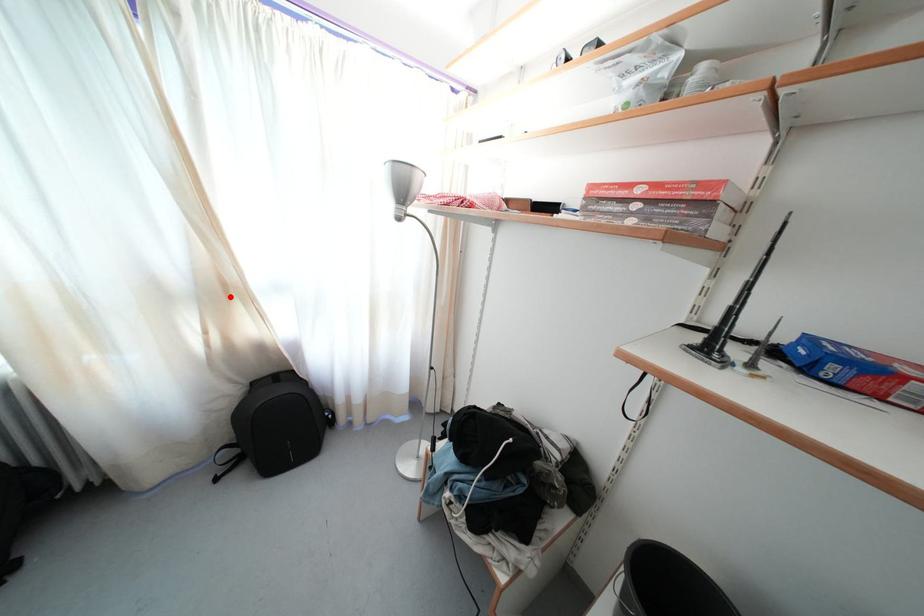
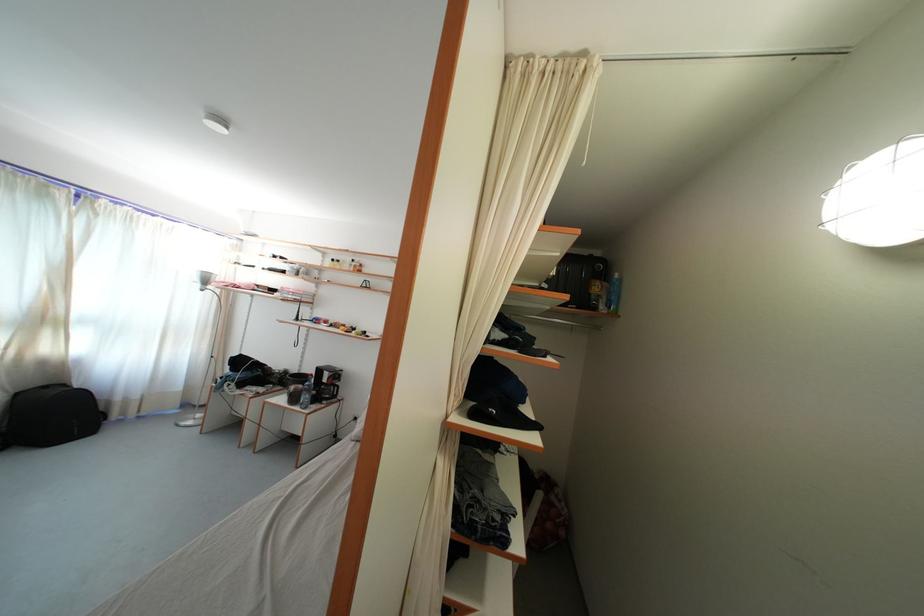
Question: I am providing you with two images of the same scene from different viewpoints. Given a red point in image1, look at the same physical point in image2. Is it:

Choices:
 (A) Closer to the viewpoint
 (B) Farther from the viewpoint

Answer: (A)